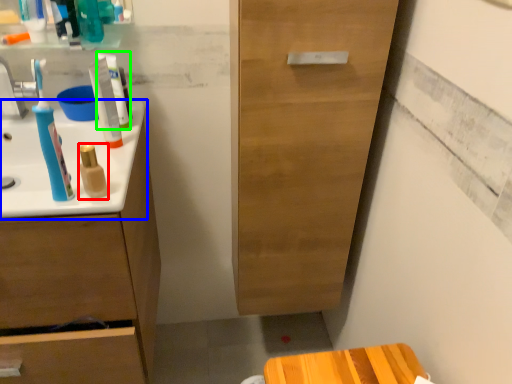
Question: Considering the real-world distances, which object is farthest from mouthwash (highlighted by a red box)? sink (highlighted by a blue box) or toothpaste (highlighted by a green box)?

Choices:
 (A) sink
 (B) toothpaste

Answer: (B)